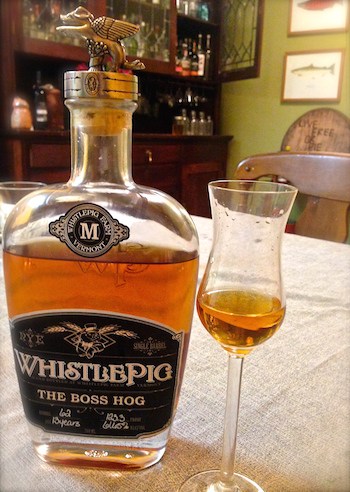
Locate an element on the screen. This screenshot has width=350, height=492. champagne glass is located at coordinates (251, 218), (228, 417).